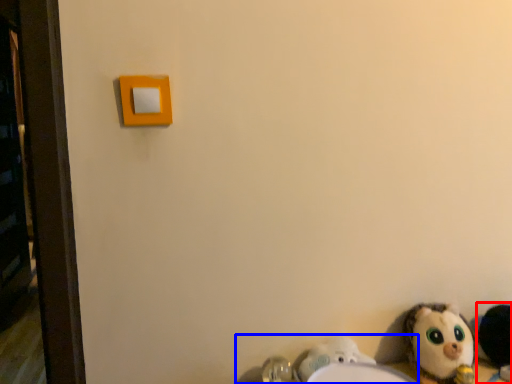
Question: Which of the following is the farthest to the observer, toy (highlighted by a red box) or sink (highlighted by a blue box)?

Choices:
 (A) toy
 (B) sink

Answer: (A)